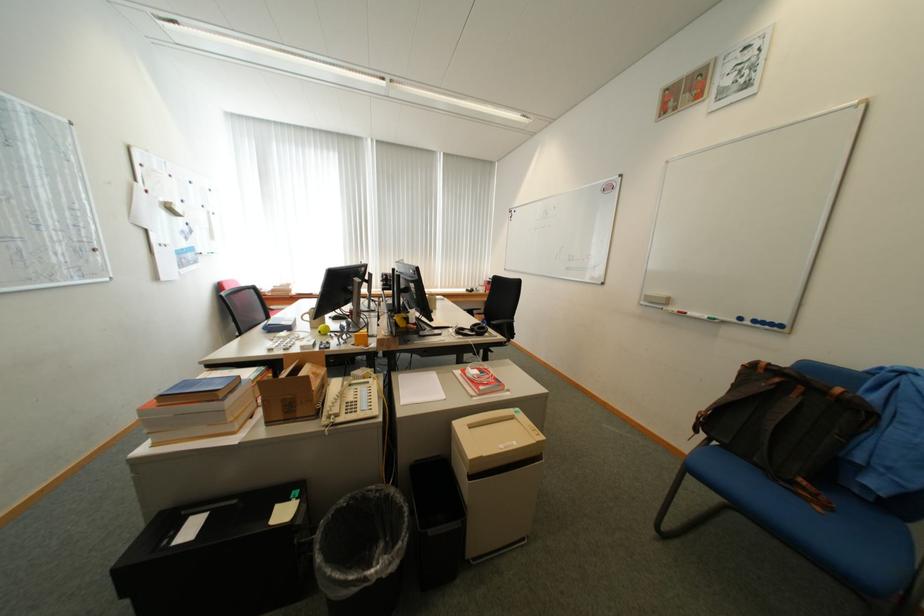
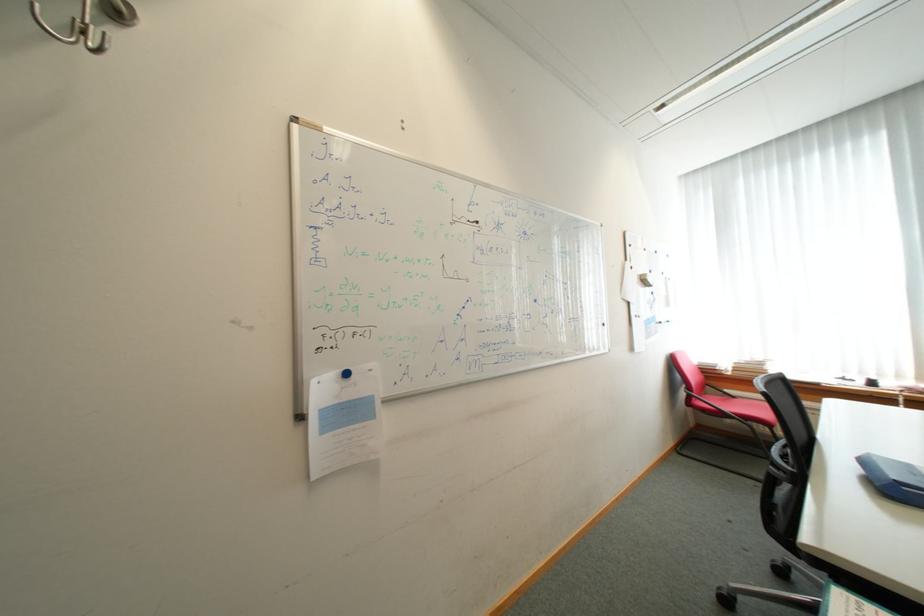
Question: The camera is either moving clockwise (left) or counter-clockwise (right) around the object. The first image is from the beginning of the video and the second image is from the end. Is the camera moving left or right when shooting the video?

Choices:
 (A) Left
 (B) Right

Answer: (B)